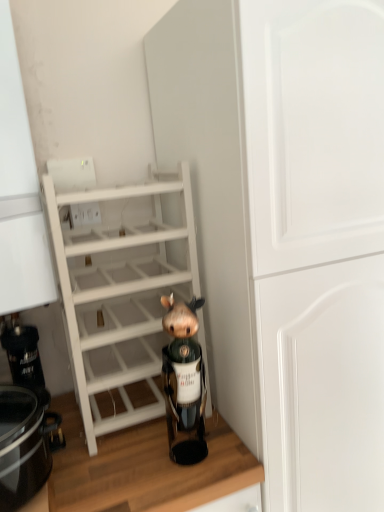
Locate an element on the screen. vacant space in between white wood shelf at center and brown matte figurine at center is located at coordinates (155, 453).